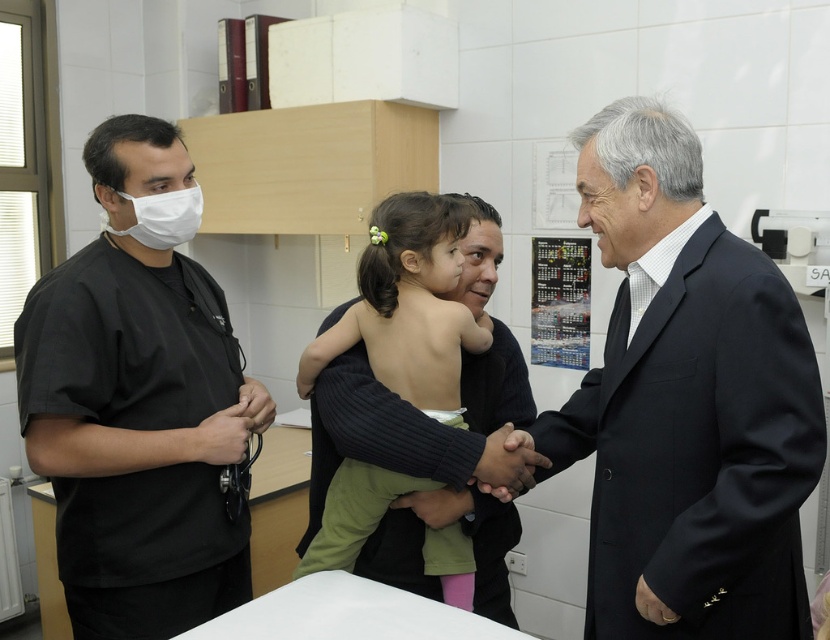
Question: Can you confirm if black suit coat at center is wider than skinny green dress at center?

Choices:
 (A) yes
 (B) no

Answer: (A)

Question: Estimate the real-world distances between objects in this image. Which object is farther from the black suit coat at center?

Choices:
 (A) metallic keychain at lower left
 (B) white matte mask at left

Answer: (B)

Question: Observing the image, what is the correct spatial positioning of skinny green dress at center in reference to white matte mask at left?

Choices:
 (A) below
 (B) above

Answer: (A)

Question: Which point appears closest to the camera in this image?

Choices:
 (A) (594, 608)
 (B) (392, 376)
 (C) (164, 196)

Answer: (A)

Question: Which object is positioned farthest from the metallic keychain at lower left?

Choices:
 (A) skinny green dress at center
 (B) black suit coat at center

Answer: (B)

Question: Does white matte mask at left appear over metallic keychain at lower left?

Choices:
 (A) no
 (B) yes

Answer: (B)